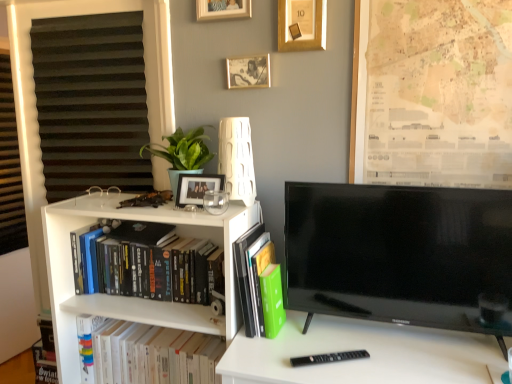
Question: Should I look upward or downward to see beige paper map at upper right?

Choices:
 (A) up
 (B) down

Answer: (A)

Question: From a real-world perspective, does wooden picture frame at upper center, arranged as the fourth picture frame when ordered from the bottom, stand above gold metallic picture frame at upper center, placed as the third picture frame when sorted from bottom to top?

Choices:
 (A) yes
 (B) no

Answer: (A)

Question: Is wooden picture frame at upper center, arranged as the fourth picture frame when ordered from the bottom, closer to the viewer compared to gold metallic picture frame at upper center, placed as the third picture frame when sorted from bottom to top?

Choices:
 (A) no
 (B) yes

Answer: (A)

Question: Can you see wooden picture frame at upper center, arranged as the fourth picture frame when ordered from the bottom, touching gold metallic picture frame at upper center, which is the second picture frame from top to bottom?

Choices:
 (A) no
 (B) yes

Answer: (A)

Question: Could you tell me if wooden picture frame at upper center, arranged as the fourth picture frame when ordered from the bottom, is turned towards gold metallic picture frame at upper center, which is the second picture frame from top to bottom?

Choices:
 (A) no
 (B) yes

Answer: (A)

Question: Considering the relative positions of wooden picture frame at upper center, arranged as the fourth picture frame when ordered from the bottom, and gold metallic picture frame at upper center, which is the second picture frame from top to bottom, in the image provided, is wooden picture frame at upper center, arranged as the fourth picture frame when ordered from the bottom, to the right of gold metallic picture frame at upper center, which is the second picture frame from top to bottom, from the viewer's perspective?

Choices:
 (A) yes
 (B) no

Answer: (B)

Question: Considering the relative sizes of wooden picture frame at upper center, the first picture frame viewed from the top, and gold metallic picture frame at upper center, which is the second picture frame from top to bottom, in the image provided, is wooden picture frame at upper center, the first picture frame viewed from the top, wider than gold metallic picture frame at upper center, which is the second picture frame from top to bottom,?

Choices:
 (A) yes
 (B) no

Answer: (B)

Question: Considering the relative sizes of wooden photo frame at upper center, placed as the third picture frame when sorted from top to bottom, and white matte lamp at upper center in the image provided, is wooden photo frame at upper center, placed as the third picture frame when sorted from top to bottom, shorter than white matte lamp at upper center?

Choices:
 (A) no
 (B) yes

Answer: (B)

Question: Is wooden photo frame at upper center, which appears as the 2th picture frame when ordered from the bottom, positioned with its back to white matte lamp at upper center?

Choices:
 (A) yes
 (B) no

Answer: (B)

Question: Does wooden photo frame at upper center, placed as the third picture frame when sorted from top to bottom, contain white matte lamp at upper center?

Choices:
 (A) no
 (B) yes

Answer: (A)

Question: Is the position of wooden photo frame at upper center, placed as the third picture frame when sorted from top to bottom, more distant than that of white matte lamp at upper center?

Choices:
 (A) yes
 (B) no

Answer: (A)

Question: Is there a large distance between wooden photo frame at upper center, placed as the third picture frame when sorted from top to bottom, and white matte lamp at upper center?

Choices:
 (A) yes
 (B) no

Answer: (B)

Question: Is wooden photo frame at upper center, which appears as the 2th picture frame when ordered from the bottom, not inside white matte lamp at upper center?

Choices:
 (A) no
 (B) yes

Answer: (B)

Question: Is wooden photo frame at upper center, placed as the third picture frame when sorted from top to bottom, positioned in front of green matte plant at upper left?

Choices:
 (A) no
 (B) yes

Answer: (A)